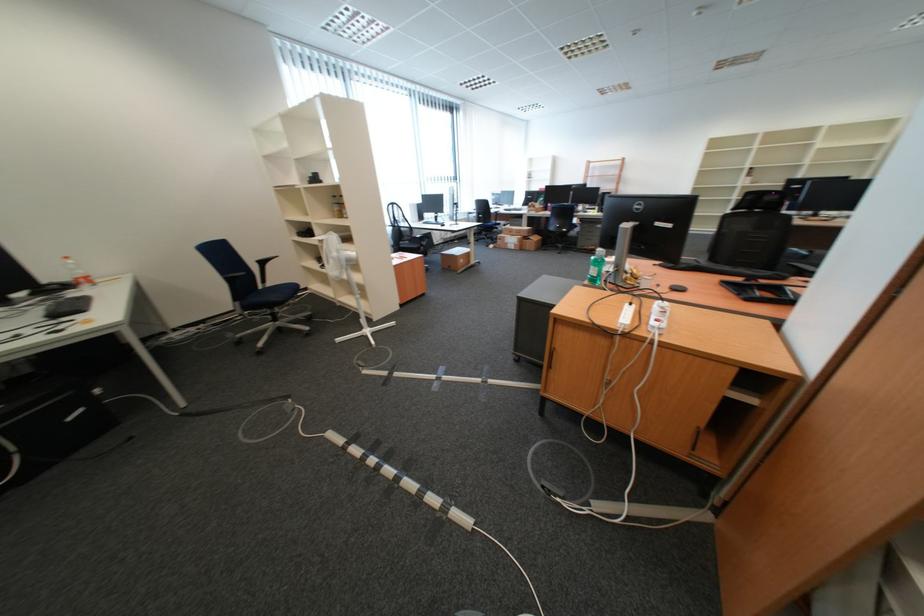
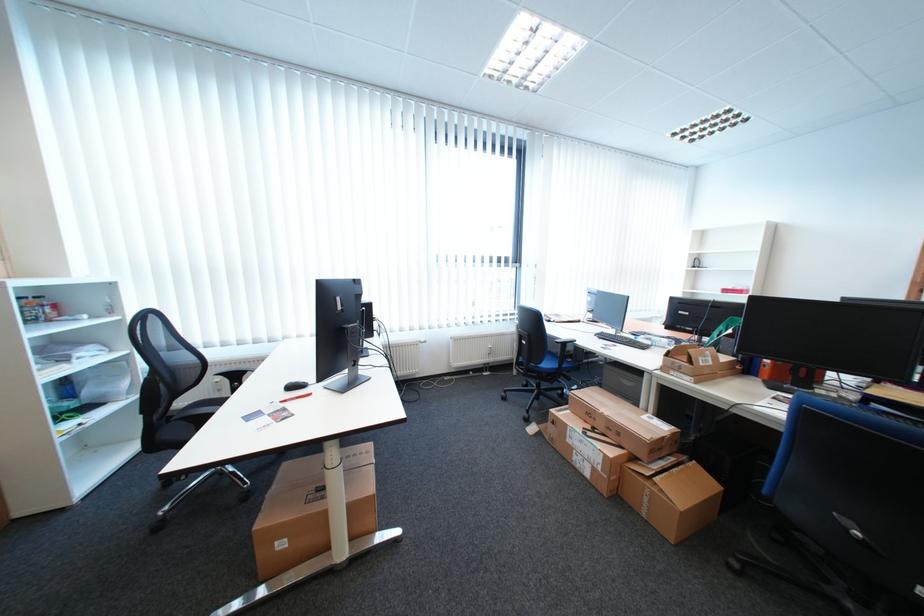
The point at (540, 246) is marked in the first image. Where is the corresponding point in the second image?

(658, 499)